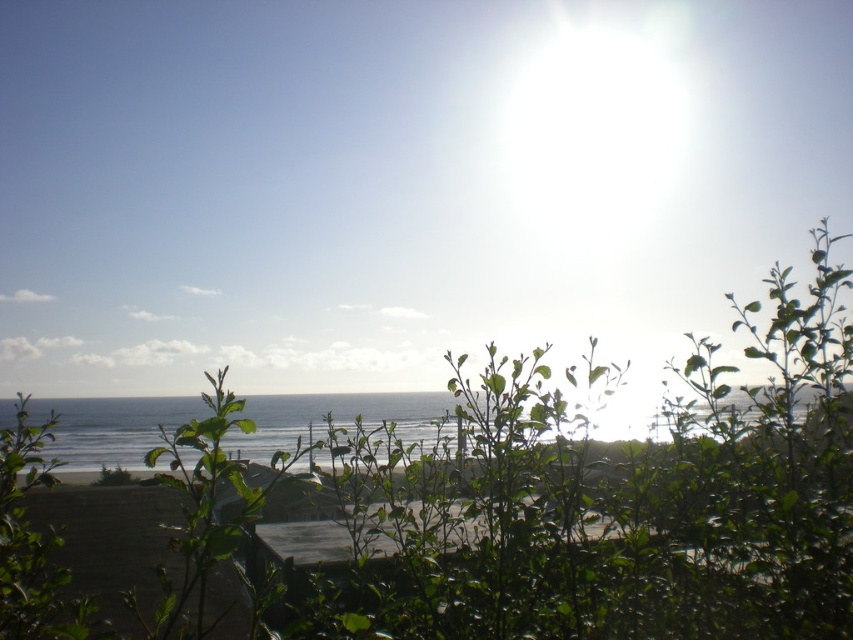
You are standing on the beach and want to take a photo of the clear blue water at center without the green leafy bush at center blocking the view. Which direction should you move to ensure the bush is out of the frame?

You should move to the right of clear blue water at center so that the green leafy bush at center is no longer blocking the view.

You are standing on the beach and want to take a photo of the clear blue water at center without the green leafy bush at center blocking the view. Is the bush too big to move out of the way?

The green leafy bush at center is larger in size than clear blue water at center. Since the bush is larger, it might be difficult to move it out of the way easily, so you might need to find another angle or position to capture the clear blue water at center without obstruction.